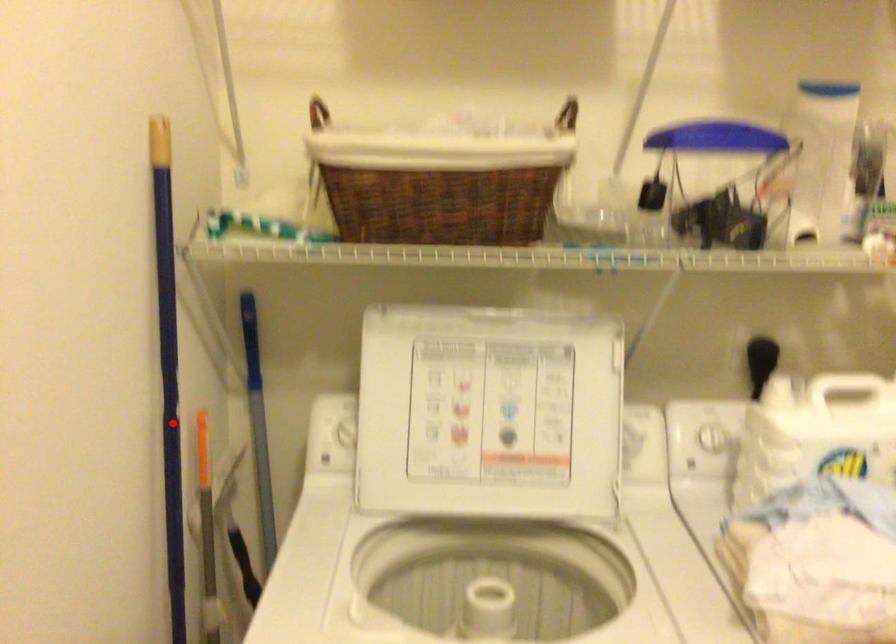
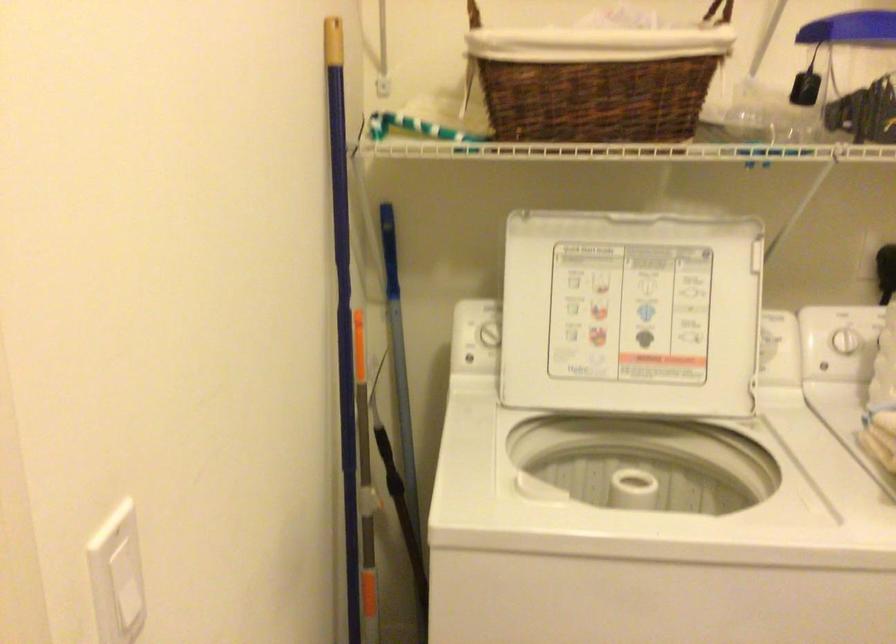
Question: I am providing you with two images of the same scene from different viewpoints. A red point is marked on the first image. Can you still see the location of the red point in image 2?

Choices:
 (A) Yes
 (B) No

Answer: (A)